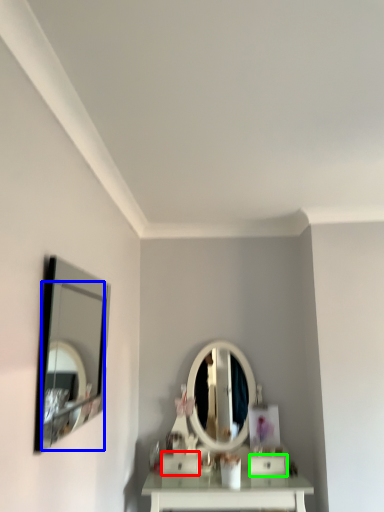
Question: Estimate the real-world distances between objects in this image. Which object is farther from drawer (highlighted by a red box), mirror (highlighted by a blue box) or drawer (highlighted by a green box)?

Choices:
 (A) mirror
 (B) drawer

Answer: (A)